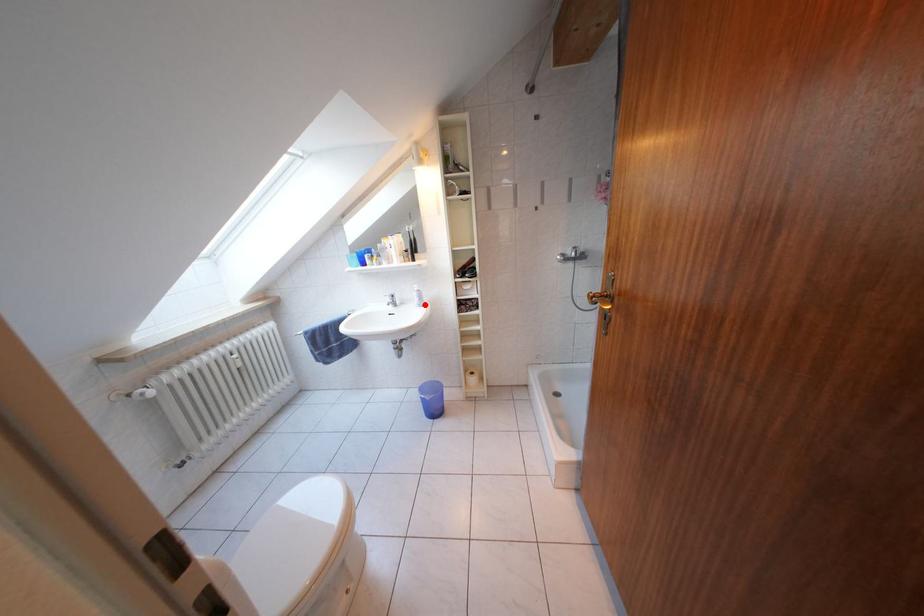
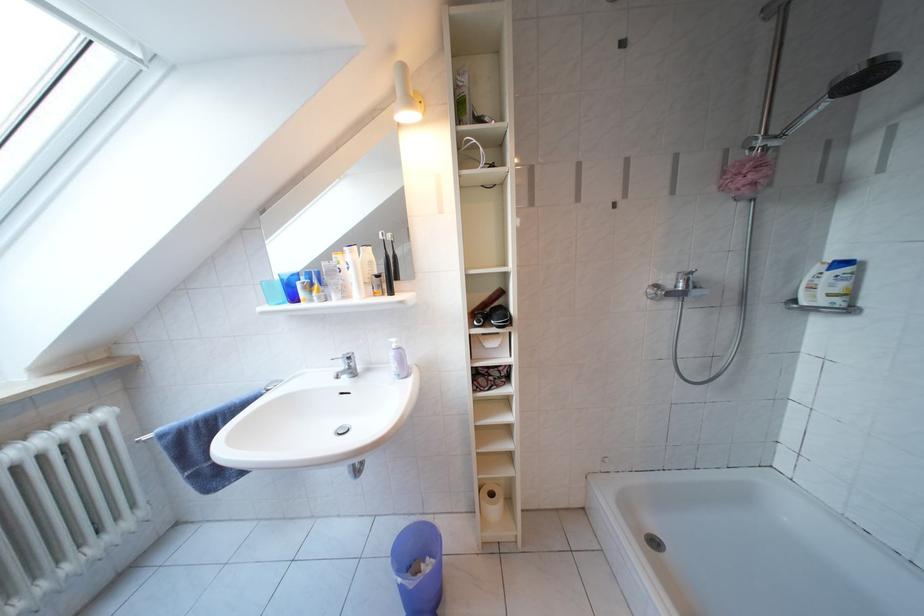
Locate, in the second image, the point that corresponds to the highlighted location in the first image.

(402, 371)